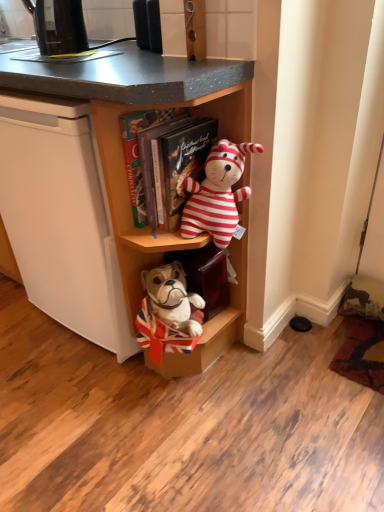
Image resolution: width=384 pixels, height=512 pixels. I want to click on free space in front of wooden cabinet at center, so click(159, 425).